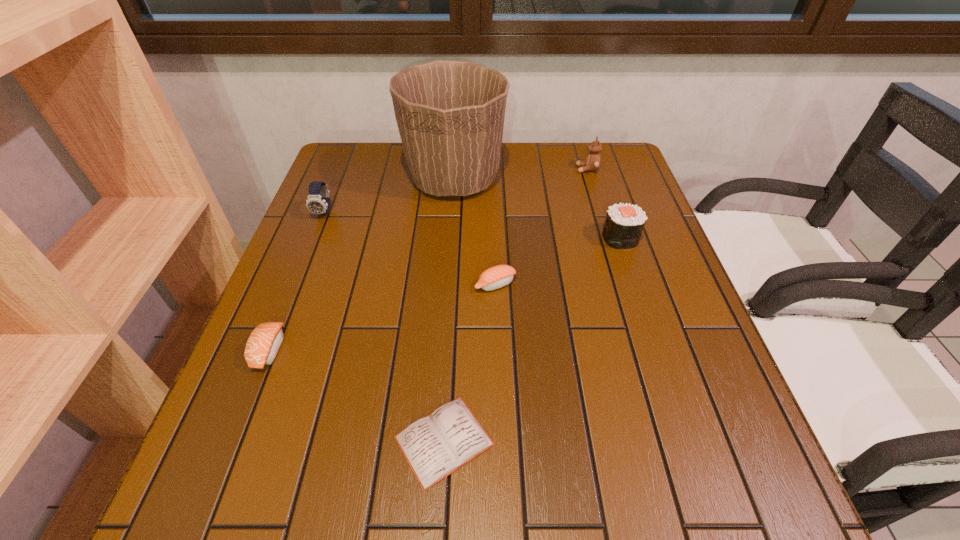
I want to click on the shortest object, so click(435, 446).

Where is `free space located on the right of the tallest object`? free space located on the right of the tallest object is located at coordinates (574, 179).

Image resolution: width=960 pixels, height=540 pixels. Find the location of `vacant space situated on the front-facing side of the teddy bear`. vacant space situated on the front-facing side of the teddy bear is located at coordinates (502, 169).

Where is `free point located on the front-facing side of the teddy bear`? This screenshot has height=540, width=960. free point located on the front-facing side of the teddy bear is located at coordinates (492, 169).

What are the coordinates of `blank area located on the front-facing side of the teddy bear` in the screenshot? It's located at (549, 169).

Where is `free space located 0.370m on the face of the watch`? This screenshot has width=960, height=540. free space located 0.370m on the face of the watch is located at coordinates (275, 338).

Image resolution: width=960 pixels, height=540 pixels. What are the coordinates of `vacant space located 0.330m on the left of the farthest sushi` in the screenshot? It's located at (469, 238).

At what (x,y) coordinates should I click in order to perform the action: click on free region located 0.360m on the front of the fifth farthest object. Please return your answer as a coordinate pair (x, y). Looking at the image, I should click on (501, 459).

This screenshot has height=540, width=960. Find the location of `vacant space located 0.050m on the back of the leftmost sushi`. vacant space located 0.050m on the back of the leftmost sushi is located at coordinates (285, 309).

Where is `blank area located on the back of the nearest object`? This screenshot has width=960, height=540. blank area located on the back of the nearest object is located at coordinates click(x=451, y=315).